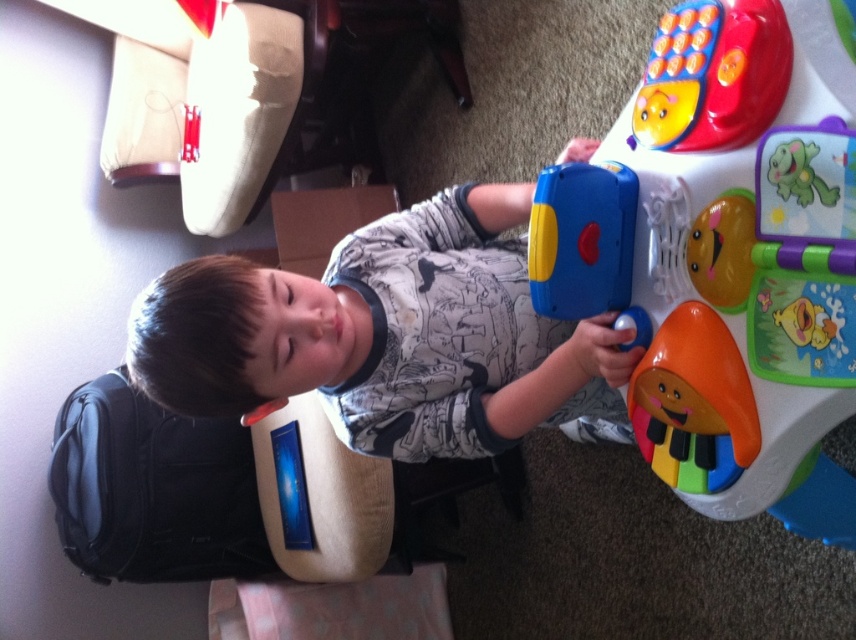
You are a parent trying to hand your child a toy. The rubberized plastic toy at center right and the matte plastic child at center are both in the room. Which one is physically closer to you so you can reach it first?

The rubberized plastic toy at center right is closer to the viewer than the matte plastic child at center, so you can reach it first.

The scene shows a rubberized plastic toy at center right and a matte plastic child at center. From the perspective of an observer looking at the image, which object is positioned lower in the frame?

The rubberized plastic toy at center right is positioned lower in the frame than the matte plastic child at center.

You are a parent trying to organize your child toys. You have a rubberized plastic toy at center right and a matte plastic child at center. Which toy is taller?

The rubberized plastic toy at center right is much taller than the matte plastic child at center.